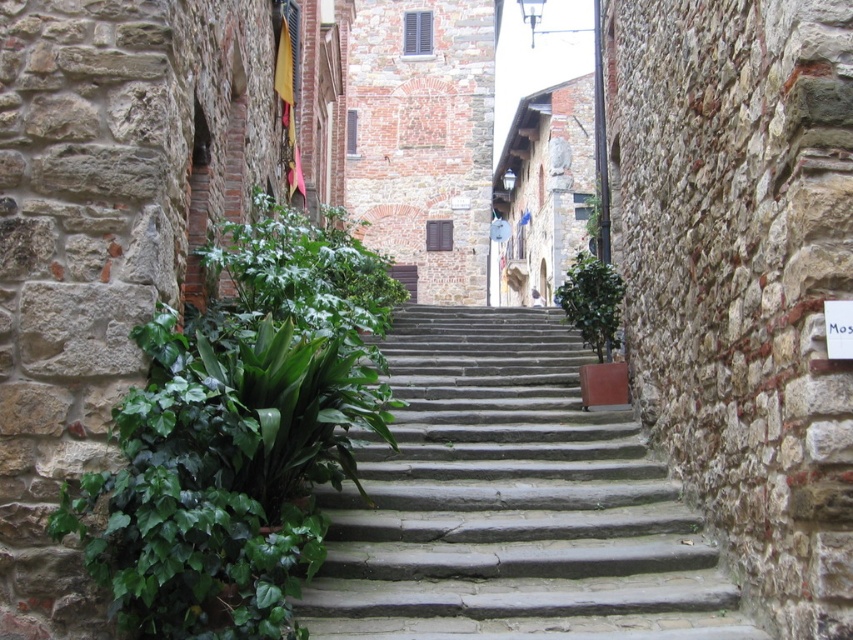
You are standing at the bottom of the stone staircase and looking upwards. There are two points marked on the wall. One is at coordinate point (341,438) and the other at point (573,305). Which point is closer to your current position?

Point (341,438) is closer to the camera than point (573,305), so the point at coordinate (341,438) is closer to your current position.

You are standing at the bottom of the stone staircase in the alleyway. There is a point marked at coordinates (509, 502). Is this point located on the stone stairs at center?

Yes, the point (509, 502) is located on the stone stairs at center as per the provided coordinates.

You are a delivery person carrying a large box that is 1.2 meters wide. You need to navigate the narrow alleyway shown in the image. Can you pass through the area between the stone stairs at center and the green leafy plant at left without tilting the box?

The stone stairs at center might be wider than the green leafy plant at left, but the exact width isn